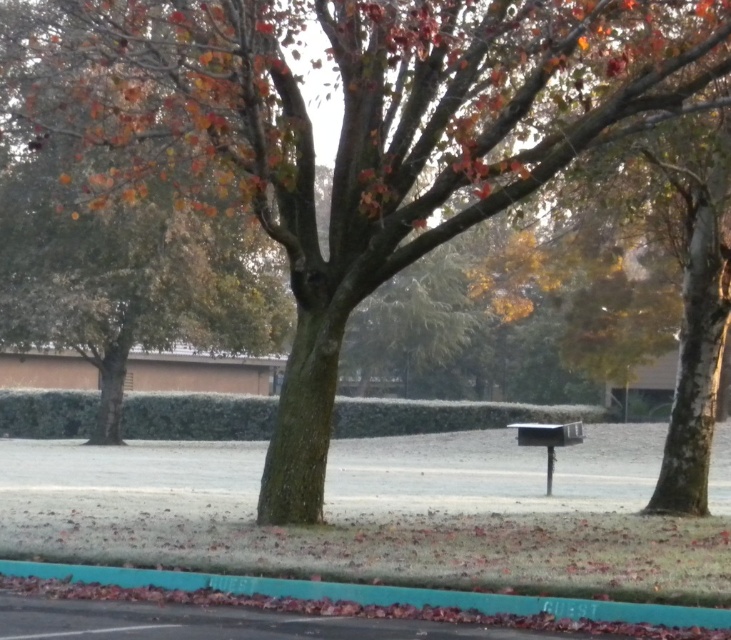
In the scene shown: Is teal rubber curb at lower center above metallic silver mailbox at center?

Yes, teal rubber curb at lower center is above metallic silver mailbox at center.

Can you confirm if teal rubber curb at lower center is smaller than metallic silver mailbox at center?

Yes.

Who is more distant from viewer, (196, 573) or (561, 442)?

The point (561, 442) is more distant.

Where is `teal rubber curb at lower center`? The height and width of the screenshot is (640, 731). teal rubber curb at lower center is located at coordinates (368, 600).